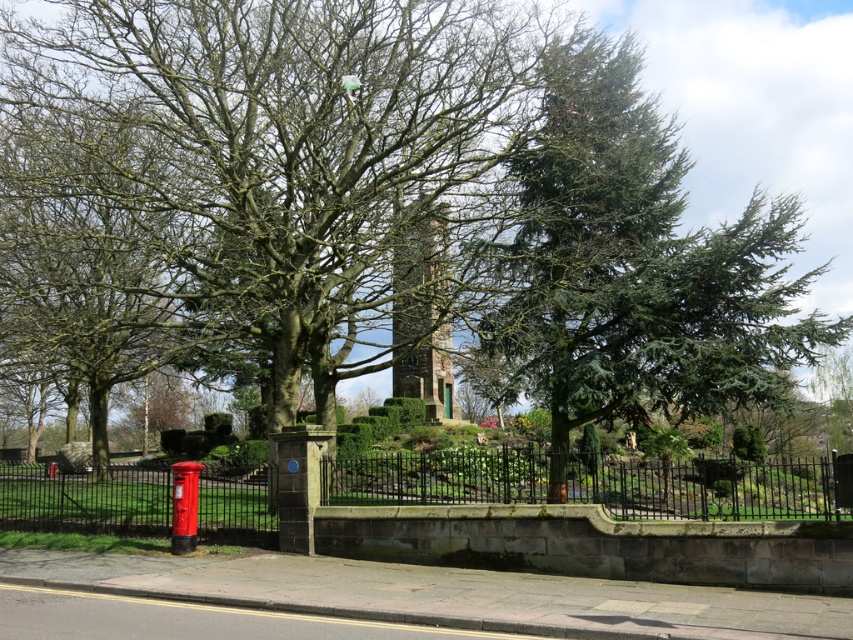
You are standing at the entrance of the garden and want to locate the green textured tree at center. According to the coordinates provided, where exactly should you look to find it?

The green textured tree at center is located at the coordinates point [281,148].